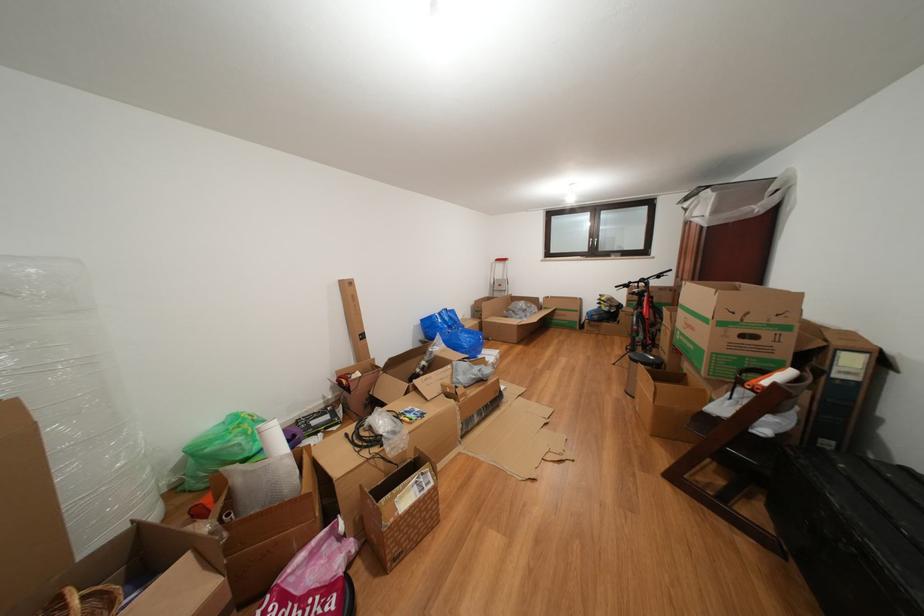
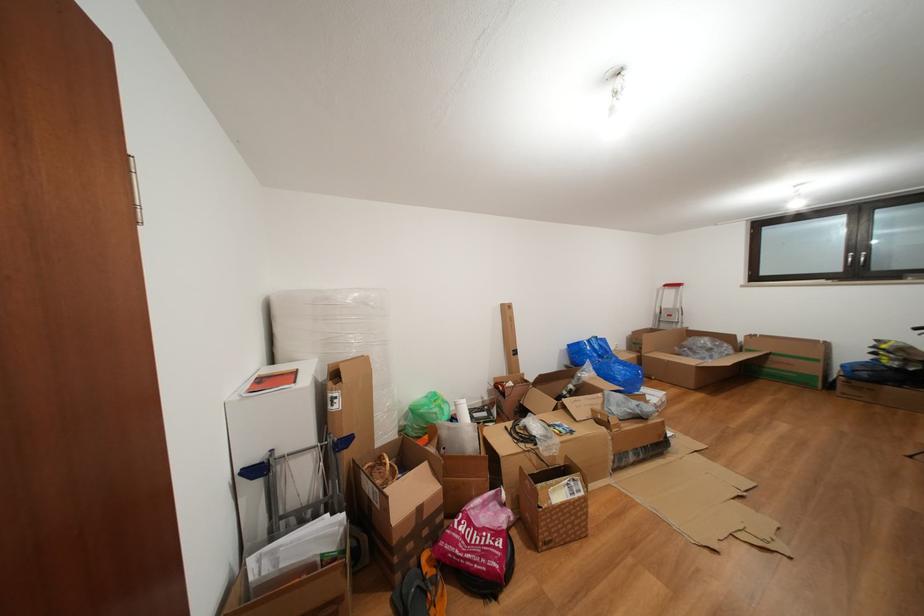
Find the pixel in the second image that matches point (298, 575) in the first image.

(480, 511)